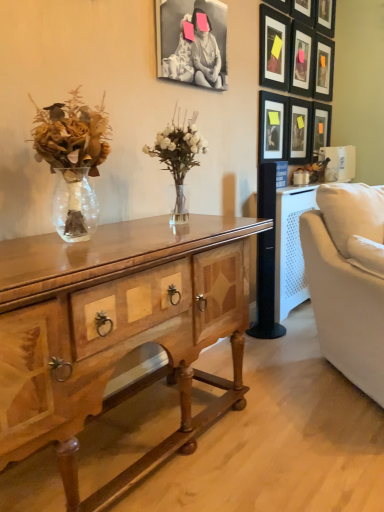
Describe the element at coordinates (326, 17) in the screenshot. The height and width of the screenshot is (512, 384). I see `wooden picture frame at upper right, which ranks as the seventh picture frame in left-to-right order` at that location.

The width and height of the screenshot is (384, 512). In order to click on wooden desk at center in this screenshot , I will do click(116, 331).

The image size is (384, 512). Describe the element at coordinates (116, 331) in the screenshot. I see `wooden desk at center` at that location.

This screenshot has width=384, height=512. Describe the element at coordinates (324, 68) in the screenshot. I see `matte black picture frame at upper right, the 2th picture frame positioned from the right` at that location.

You are a GUI agent. You are given a task and a screenshot of the screen. Output one action in this format:
    pyautogui.click(x=<x>, y=<y>)
    Task: Click on the wooden picture frame at upper right, which ranks as the seventh picture frame in left-to-right order
    This screenshot has width=384, height=512.
    Given the screenshot: What is the action you would take?
    pyautogui.click(x=326, y=17)

From a real-world perspective, is matte black picture frame at upper right, the 2th picture frame positioned from the right, located higher than matte black picture frame at upper right, which appears as the sixth picture frame when viewed from the left?

Correct, in the physical world, matte black picture frame at upper right, the 2th picture frame positioned from the right, is higher than matte black picture frame at upper right, which appears as the sixth picture frame when viewed from the left.

Considering the relative positions of matte black picture frame at upper right, which appears as the 8th picture frame when viewed from the left, and matte black picture frame at upper right, which ranks as the fourth picture frame in right-to-left order, in the image provided, is matte black picture frame at upper right, which appears as the 8th picture frame when viewed from the left, to the left of matte black picture frame at upper right, which ranks as the fourth picture frame in right-to-left order, from the viewer's perspective?

Incorrect, matte black picture frame at upper right, which appears as the 8th picture frame when viewed from the left, is not on the left side of matte black picture frame at upper right, which ranks as the fourth picture frame in right-to-left order.

Is matte black picture frame at upper right, the 2th picture frame positioned from the right, positioned far away from matte black picture frame at upper right, which appears as the sixth picture frame when viewed from the left?

matte black picture frame at upper right, the 2th picture frame positioned from the right, is actually quite close to matte black picture frame at upper right, which appears as the sixth picture frame when viewed from the left.

Can you tell me how much matte black picture frame at upper right, which appears as the sixth picture frame when viewed from the left, and matte black picture frame at upper right, arranged as the eighth picture frame when viewed from the right, differ in facing direction?

0.00503 degrees.

Is there a large distance between matte black picture frame at upper right, which appears as the sixth picture frame when viewed from the left, and matte black picture frame at upper right, arranged as the eighth picture frame when viewed from the right?

No, matte black picture frame at upper right, which appears as the sixth picture frame when viewed from the left, is in close proximity to matte black picture frame at upper right, arranged as the eighth picture frame when viewed from the right.

Starting from the matte black picture frame at upper right, which appears as the sixth picture frame when viewed from the left, which picture frame is the 4th one in front? Please provide its 2D coordinates.

[(274, 49)]

In the image, is matte black picture frame at upper right, which ranks as the fourth picture frame in right-to-left order, positioned in front of or behind matte black picture frame at upper right, arranged as the eighth picture frame when viewed from the right?

In the image, matte black picture frame at upper right, which ranks as the fourth picture frame in right-to-left order, appears behind matte black picture frame at upper right, arranged as the eighth picture frame when viewed from the right.

Does point (259, 116) come closer to viewer compared to point (62, 369)?

No, (259, 116) is further to viewer.

Which is correct: matte black picture frame at upper right, the seventh picture frame in the right-to-left sequence, is inside wooden desk at center, or outside of it?

matte black picture frame at upper right, the seventh picture frame in the right-to-left sequence, is not enclosed by wooden desk at center.

You are a GUI agent. You are given a task and a screenshot of the screen. Output one action in this format:
    pyautogui.click(x=<x>, y=<y>)
    Task: Click on the 3rd picture frame behind the wooden desk at center
    The width and height of the screenshot is (384, 512).
    Given the screenshot: What is the action you would take?
    pyautogui.click(x=273, y=127)

Looking at this image, is matte black picture frame at upper right, the seventh picture frame in the right-to-left sequence, aimed at wooden desk at center?

No, matte black picture frame at upper right, the seventh picture frame in the right-to-left sequence, is not oriented towards wooden desk at center.

Looking at this image, from a real-world perspective, which object stands above the other?

From a 3D spatial view, wooden picture frame at upper right, the 5th picture frame viewed from the left, is above.

Which object is thinner, wooden picture frame at upper right, the 5th picture frame viewed from the left, or matte black picture frame at upper right, which ranks as the ninth picture frame in left-to-right order?

matte black picture frame at upper right, which ranks as the ninth picture frame in left-to-right order.

Which of these two, wooden picture frame at upper right, the 5th picture frame viewed from the left, or matte black picture frame at upper right, the first picture frame viewed from the right, is bigger?

wooden picture frame at upper right, the 5th picture frame viewed from the left, is bigger.

Is wooden picture frame at upper right, positioned as the sixth picture frame in right-to-left order, beside matte black picture frame at upper right, which appears as the 8th picture frame when viewed from the left?

No, wooden picture frame at upper right, positioned as the sixth picture frame in right-to-left order, is not beside matte black picture frame at upper right, which appears as the 8th picture frame when viewed from the left.

Considering the relative positions of wooden picture frame at upper right, which is the fourth picture frame in left-to-right order, and matte black picture frame at upper right, the 2th picture frame positioned from the right, in the image provided, is wooden picture frame at upper right, which is the fourth picture frame in left-to-right order, behind matte black picture frame at upper right, the 2th picture frame positioned from the right,?

No, the depth of wooden picture frame at upper right, which is the fourth picture frame in left-to-right order, is less than that of matte black picture frame at upper right, the 2th picture frame positioned from the right.

Considering the points (307, 7) and (320, 42), which point is in front, point (307, 7) or point (320, 42)?

The point (307, 7) is closer to the camera.

Is point (334, 27) farther from viewer compared to point (328, 140)?

No, it is not.

From the image's perspective, who appears lower, wooden picture frame at upper right, which is the third picture frame in right-to-left order, or matte black picture frame at upper right, which ranks as the ninth picture frame in left-to-right order?

matte black picture frame at upper right, which ranks as the ninth picture frame in left-to-right order.

Consider the image. Is wooden picture frame at upper right, which ranks as the seventh picture frame in left-to-right order, spatially inside matte black picture frame at upper right, the first picture frame viewed from the right, or outside of it?

wooden picture frame at upper right, which ranks as the seventh picture frame in left-to-right order, is located beyond the bounds of matte black picture frame at upper right, the first picture frame viewed from the right.

Which is more to the left, wooden picture frame at upper right, which is the fourth picture frame in left-to-right order, or black matte picture frame at upper center, arranged as the 1th picture frame when viewed from the left?

black matte picture frame at upper center, arranged as the 1th picture frame when viewed from the left, is more to the left.

Which object is closer to the camera taking this photo, wooden picture frame at upper right, which is the fourth picture frame in left-to-right order, or black matte picture frame at upper center, which is the 9th picture frame in right-to-left order?

black matte picture frame at upper center, which is the 9th picture frame in right-to-left order, is in front.

How much distance is there between wooden picture frame at upper right, positioned as the sixth picture frame in right-to-left order, and black matte picture frame at upper center, which is the 9th picture frame in right-to-left order?

wooden picture frame at upper right, positioned as the sixth picture frame in right-to-left order, and black matte picture frame at upper center, which is the 9th picture frame in right-to-left order, are 1.12 meters apart.

Is wooden picture frame at upper right, positioned as the sixth picture frame in right-to-left order, shorter than black matte picture frame at upper center, which is the 9th picture frame in right-to-left order?

→ Indeed, wooden picture frame at upper right, positioned as the sixth picture frame in right-to-left order, has a lesser height compared to black matte picture frame at upper center, which is the 9th picture frame in right-to-left order.

I want to click on the 5th picture frame below the matte black picture frame at upper right, which appears as the 8th picture frame when viewed from the left (from the image's perspective), so click(299, 131).

From the image's perspective, which picture frame is the 3rd one above the matte black picture frame at upper right, which ranks as the fourth picture frame in right-to-left order? Please provide its 2D coordinates.

[(274, 49)]

Estimate the real-world distances between objects in this image. Which object is further from matte black picture frame at upper right, the 2th picture frame positioned from the right, black matte picture frame at upper center, arranged as the 1th picture frame when viewed from the left, or matte black picture frame at upper right, which ranks as the ninth picture frame in left-to-right order?

black matte picture frame at upper center, arranged as the 1th picture frame when viewed from the left.

When comparing their distances from matte black picture frame at upper right, the third picture frame viewed from the left, does wooden desk at center or matte black picture frame at upper right, acting as the 2th picture frame starting from the left, seem further?

Based on the image, wooden desk at center appears to be further to matte black picture frame at upper right, the third picture frame viewed from the left.

Based on their spatial positions, is matte black picture frame at upper right, the first picture frame viewed from the right, or matte black picture frame at upper right, acting as the 2th picture frame starting from the left, further from wooden picture frame at upper right, which ranks as the 5th picture frame in right-to-left order?

matte black picture frame at upper right, the first picture frame viewed from the right.

Which object lies further to the anchor point matte black picture frame at upper right, the seventh picture frame in the right-to-left sequence, wooden picture frame at upper right, which ranks as the 5th picture frame in right-to-left order, or wooden picture frame at upper right, positioned as the sixth picture frame in right-to-left order?

wooden picture frame at upper right, positioned as the sixth picture frame in right-to-left order, is further to matte black picture frame at upper right, the seventh picture frame in the right-to-left sequence.

Looking at the image, which one is located further to matte black picture frame at upper right, which ranks as the fourth picture frame in right-to-left order, matte black picture frame at upper right, which ranks as the ninth picture frame in left-to-right order, or wooden picture frame at upper right, which is the fourth picture frame in left-to-right order?

wooden picture frame at upper right, which is the fourth picture frame in left-to-right order, lies further to matte black picture frame at upper right, which ranks as the fourth picture frame in right-to-left order, than the other object.

When comparing their distances from wooden picture frame at upper right, the 5th picture frame viewed from the left, does matte black picture frame at upper right, which ranks as the ninth picture frame in left-to-right order, or wooden picture frame at upper right, which is the third picture frame in right-to-left order, seem further?

matte black picture frame at upper right, which ranks as the ninth picture frame in left-to-right order, is further to wooden picture frame at upper right, the 5th picture frame viewed from the left.

Consider the image. Looking at the image, which one is located closer to matte black picture frame at upper right, the third picture frame viewed from the left, wooden picture frame at upper right, the 5th picture frame viewed from the left, or matte black picture frame at upper right, which ranks as the ninth picture frame in left-to-right order?

wooden picture frame at upper right, the 5th picture frame viewed from the left, is closer to matte black picture frame at upper right, the third picture frame viewed from the left.

Estimate the real-world distances between objects in this image. Which object is further from wooden picture frame at upper right, which ranks as the seventh picture frame in left-to-right order, wooden desk at center or wooden picture frame at upper right, which ranks as the 5th picture frame in right-to-left order?

wooden desk at center is further to wooden picture frame at upper right, which ranks as the seventh picture frame in left-to-right order.

Find the location of a particular element. This screenshot has height=512, width=384. picture frame between wooden picture frame at upper right, which ranks as the seventh picture frame in left-to-right order, and matte black picture frame at upper right, the 2th picture frame positioned from the right, in the vertical direction is located at coordinates (303, 11).

Identify the location of picture frame between black matte picture frame at upper center, which is the 9th picture frame in right-to-left order, and matte black picture frame at upper right, the seventh picture frame in the right-to-left sequence, along the z-axis. This screenshot has width=384, height=512. (274, 49).